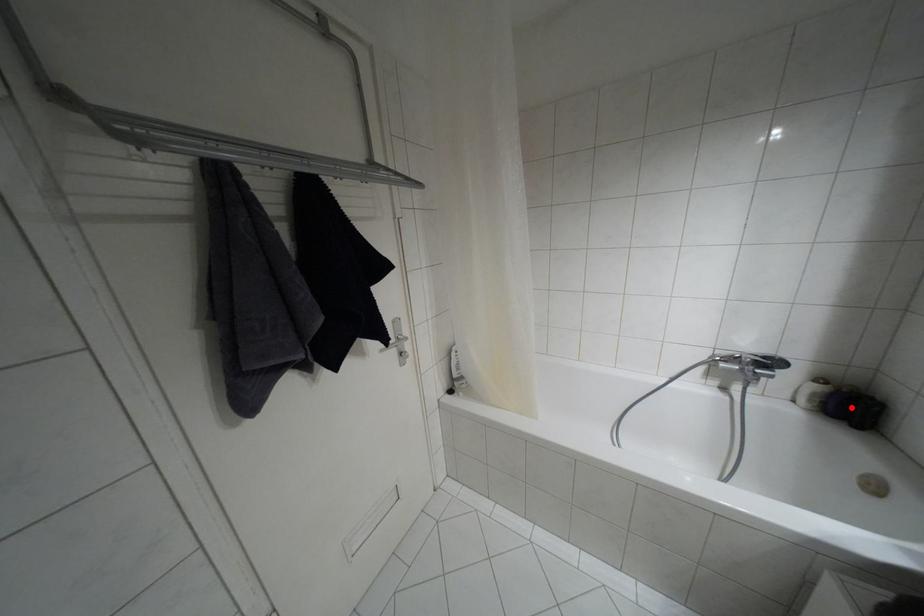
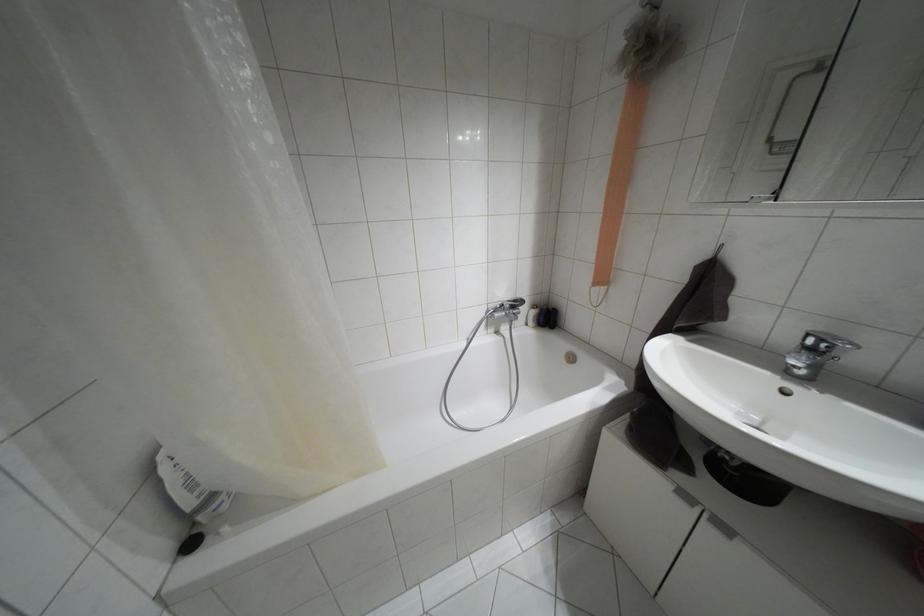
Question: A red point is marked in image1. In image2, is the corresponding 3D point closer to the camera or farther? Reply with the corresponding letter.

Choices:
 (A) The corresponding 3D point is closer.
 (B) The corresponding 3D point is farther.

Answer: (A)